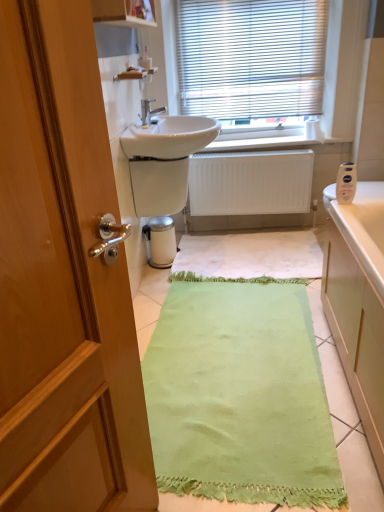
Question: Is white plastic blinds at upper center not near matte silver faucet at center?

Choices:
 (A) yes
 (B) no

Answer: (B)

Question: From a real-world perspective, is white plastic blinds at upper center on top of matte silver faucet at center?

Choices:
 (A) yes
 (B) no

Answer: (A)

Question: From the image's perspective, does white plastic blinds at upper center appear higher than matte silver faucet at center?

Choices:
 (A) yes
 (B) no

Answer: (A)

Question: From a real-world perspective, does white plastic blinds at upper center sit lower than matte silver faucet at center?

Choices:
 (A) no
 (B) yes

Answer: (A)

Question: Considering the relative sizes of white plastic blinds at upper center and matte silver faucet at center in the image provided, is white plastic blinds at upper center bigger than matte silver faucet at center?

Choices:
 (A) yes
 (B) no

Answer: (A)

Question: Does point (150, 116) appear closer or farther from the camera than point (145, 153)?

Choices:
 (A) closer
 (B) farther

Answer: (B)

Question: In terms of width, does matte silver faucet at center look wider or thinner when compared to white glossy sink at center?

Choices:
 (A) wide
 (B) thin

Answer: (B)

Question: Considering the positions of matte silver faucet at center and white glossy sink at center in the image, is matte silver faucet at center bigger or smaller than white glossy sink at center?

Choices:
 (A) small
 (B) big

Answer: (A)

Question: From the image's perspective, relative to white glossy sink at center, is matte silver faucet at center above or below?

Choices:
 (A) above
 (B) below

Answer: (A)

Question: From a real-world perspective, is matte silver faucet at center positioned above or below white plastic blinds at upper center?

Choices:
 (A) above
 (B) below

Answer: (B)

Question: Considering their positions, is matte silver faucet at center located in front of or behind white plastic blinds at upper center?

Choices:
 (A) behind
 (B) front

Answer: (B)

Question: In terms of height, does matte silver faucet at center look taller or shorter compared to white plastic blinds at upper center?

Choices:
 (A) short
 (B) tall

Answer: (A)

Question: Looking at their shapes, would you say matte silver faucet at center is wider or thinner than white plastic blinds at upper center?

Choices:
 (A) wide
 (B) thin

Answer: (A)

Question: Considering the positions of point (139, 115) and point (225, 197), is point (139, 115) closer or farther from the camera than point (225, 197)?

Choices:
 (A) closer
 (B) farther

Answer: (A)

Question: Would you say matte silver faucet at center is to the left or to the right of white matte radiator at center in the picture?

Choices:
 (A) right
 (B) left

Answer: (B)